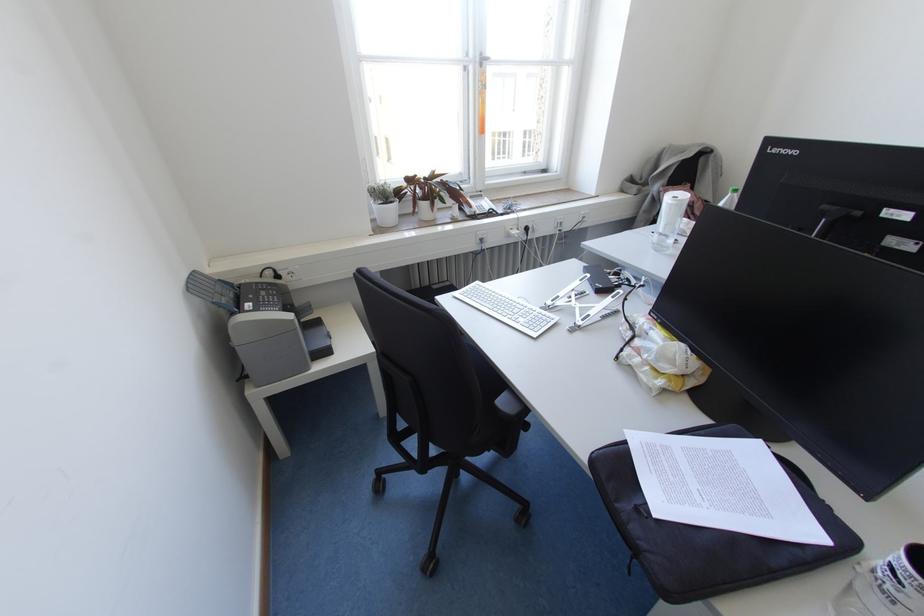
The image size is (924, 616). Find the location of `phone handset`. phone handset is located at coordinates (482, 208).